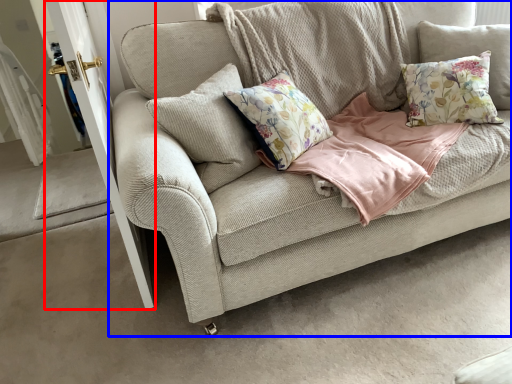
Question: Which of the following is the closest to the observer, screen door (highlighted by a red box) or studio couch (highlighted by a blue box)?

Choices:
 (A) screen door
 (B) studio couch

Answer: (B)